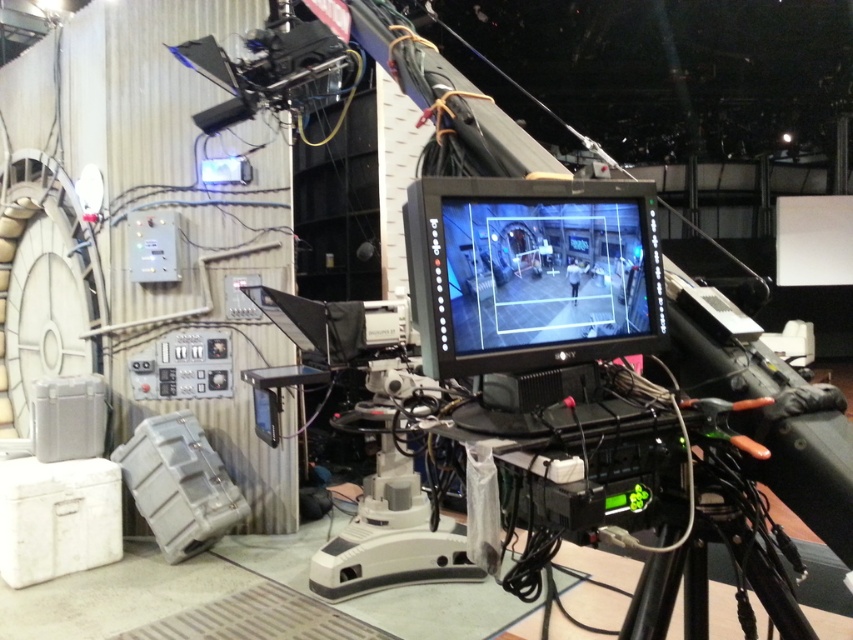
Consider the image. You are an assistant director on set and need to adjust the camera angle. You have to move the matte black monitor at center and the black plastic tripod at lower right. Which object should you move first if you want to avoid obstructing the other?

You should move the matte black monitor at center first because it is located above the black plastic tripod at lower right. By adjusting the monitor first, you can ensure that moving the tripod later won

You are a camera operator standing at the back of the studio. You need to adjust the matte black monitor at center and the black plastic tripod at lower right. Which object is closer to you?

The matte black monitor at center is closer to you because it is further to the viewer than the black plastic tripod at lower right, meaning it is positioned nearer in the scene.